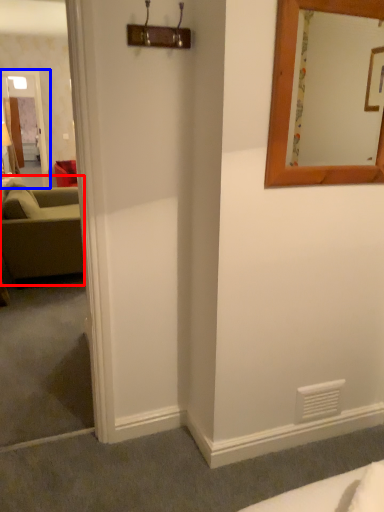
Question: Which object appears closest to the camera in this image, studio couch (highlighted by a red box) or glass door (highlighted by a blue box)?

Choices:
 (A) studio couch
 (B) glass door

Answer: (A)